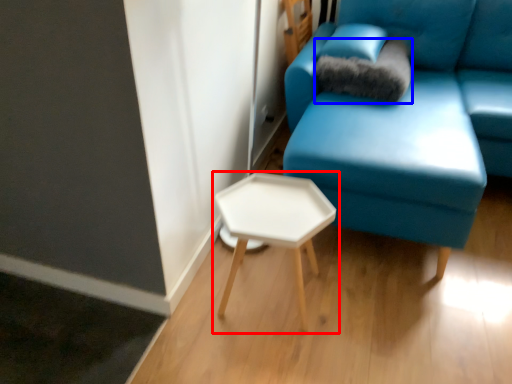
Question: Among these objects, which one is farthest to the camera, table (highlighted by a red box) or pillow (highlighted by a blue box)?

Choices:
 (A) table
 (B) pillow

Answer: (B)